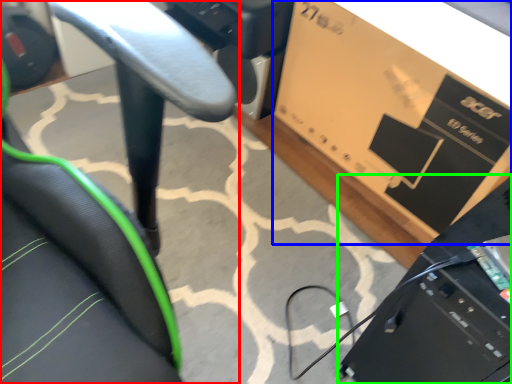
Question: Considering the real-world distances, which object is closest to chair (highlighted by a red box)? cardboard box (highlighted by a blue box) or computer (highlighted by a green box).

Choices:
 (A) cardboard box
 (B) computer

Answer: (B)